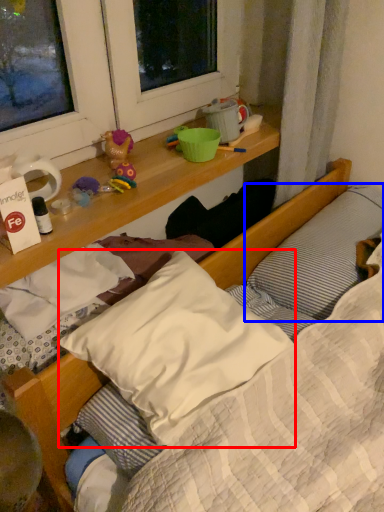
Question: Among these objects, which one is farthest to the camera, pillow (highlighted by a red box) or pillow (highlighted by a blue box)?

Choices:
 (A) pillow
 (B) pillow

Answer: (B)